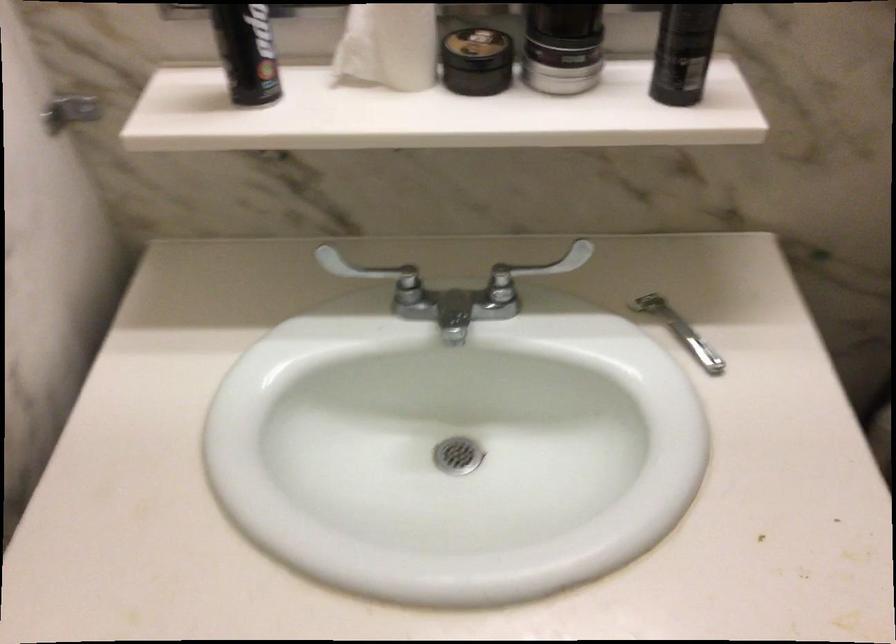
Which object does [246,53] point to?

It refers to a black bottle.